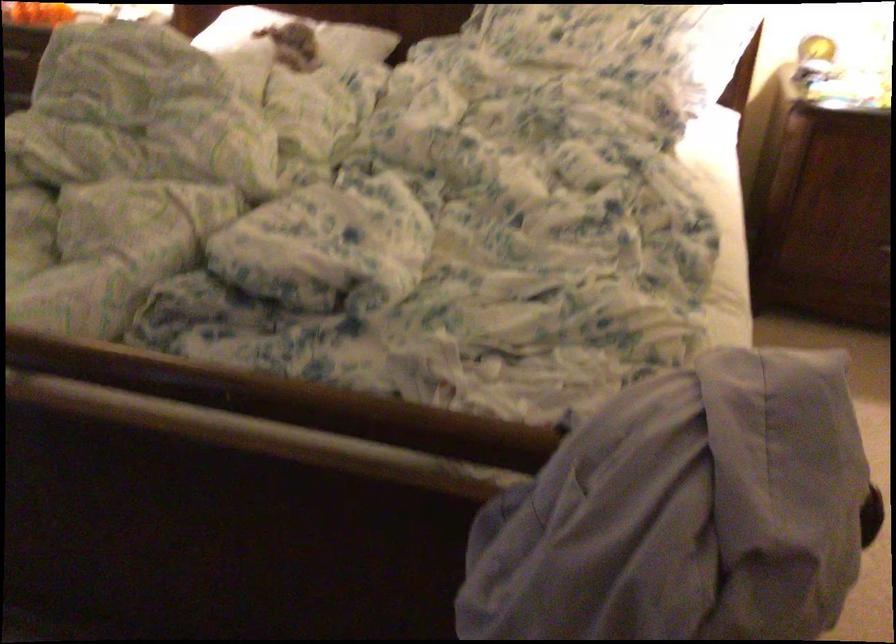
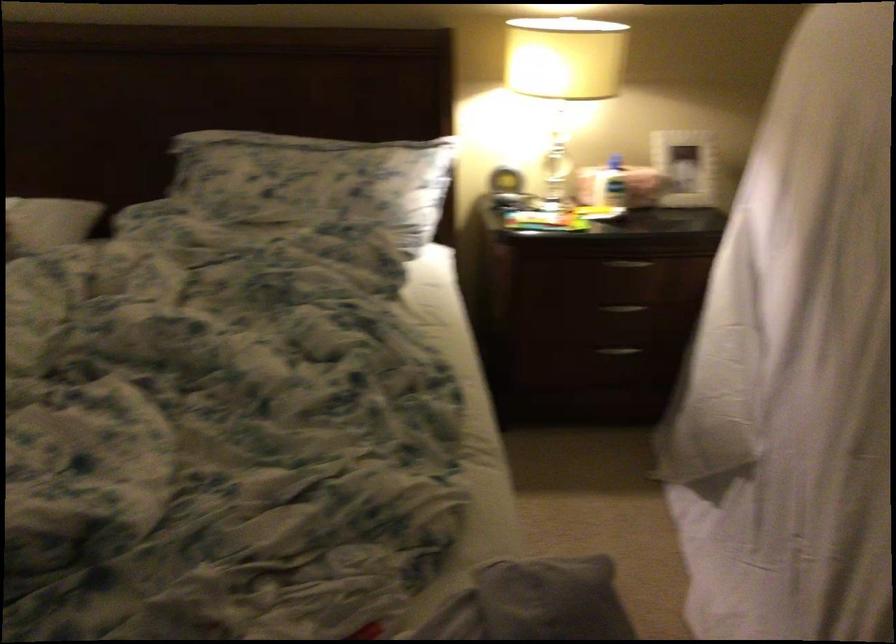
Question: The camera is either moving clockwise (left) or counter-clockwise (right) around the object. The first image is from the beginning of the video and the second image is from the end. Is the camera moving left or right when shooting the video?

Choices:
 (A) Left
 (B) Right

Answer: (A)